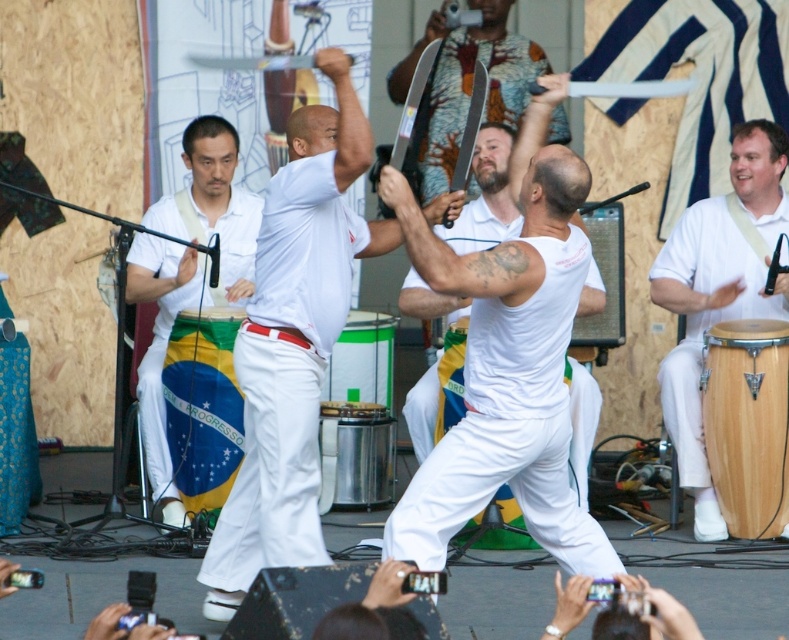
Question: Which of these objects is positioned farthest from the white wooden drum at center?

Choices:
 (A) white wood drum at right
 (B) white matte tank top at center
 (C) green metallic drum at center
 (D) white cotton shirt at center

Answer: (A)

Question: Can you confirm if white wood drum at right is smaller than metallic silver drum at center?

Choices:
 (A) no
 (B) yes

Answer: (A)

Question: Does white matte tank top at center have a larger size compared to white wood drum at right?

Choices:
 (A) yes
 (B) no

Answer: (A)

Question: From the image, what is the correct spatial relationship of natural wood conga at center in relation to metallic silver drum at center?

Choices:
 (A) right
 (B) left

Answer: (A)

Question: Which point appears closest to the camera in this image?

Choices:
 (A) (730, 419)
 (B) (737, 266)
 (C) (371, 504)
 (D) (219, 291)

Answer: (A)

Question: Which of the following is the farthest from the observer?

Choices:
 (A) white matte tank top at center
 (B) white cotton pants at center

Answer: (B)